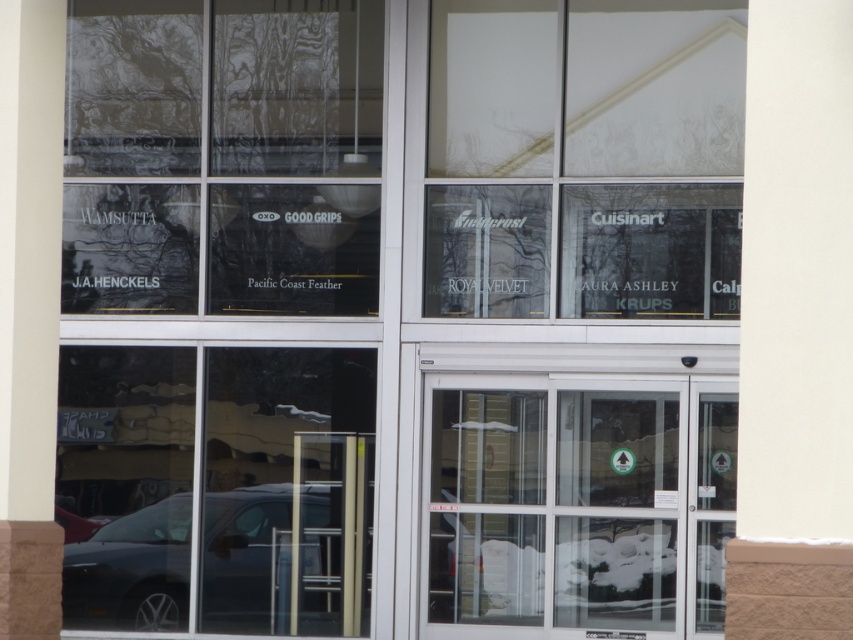
Question: Considering the real-world distances, which object is closest to the dark gray metallic car at lower left?

Choices:
 (A) white frosted glass at upper center
 (B) transparent glass window at upper left

Answer: (B)

Question: Is transparent glass window at upper left above dark gray metallic car at lower left?

Choices:
 (A) yes
 (B) no

Answer: (A)

Question: Which point is farther from the camera taking this photo?

Choices:
 (A) (717, 392)
 (B) (140, 264)

Answer: (B)

Question: Is transparent glass window at upper left smaller than clear glass door at center?

Choices:
 (A) no
 (B) yes

Answer: (A)

Question: Estimate the real-world distances between objects in this image. Which object is closer to the white frosted glass at upper center?

Choices:
 (A) clear glass door at center
 (B) dark gray metallic car at lower left
 (C) transparent glass window at upper left

Answer: (C)

Question: Is white frosted glass at upper center smaller than dark gray metallic car at lower left?

Choices:
 (A) no
 (B) yes

Answer: (A)